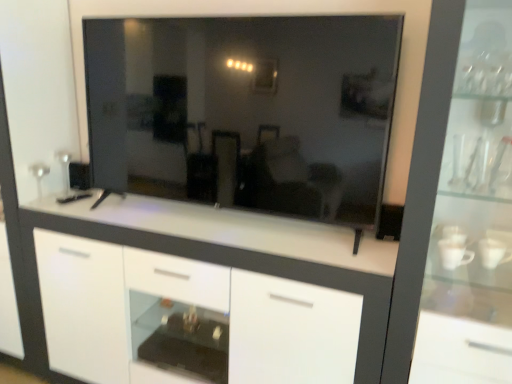
What are the coordinates of `transparent glass cabinet at right` in the screenshot? It's located at (472, 215).

Image resolution: width=512 pixels, height=384 pixels. What do you see at coordinates (472, 215) in the screenshot?
I see `transparent glass cabinet at right` at bounding box center [472, 215].

Measure the distance between transparent glass mirror at center and camera.

The depth of transparent glass mirror at center is 4.47 feet.

You are a GUI agent. You are given a task and a screenshot of the screen. Output one action in this format:
    pyautogui.click(x=<x>, y=<y>)
    Task: Click on the transparent glass cabinet at right
    The width and height of the screenshot is (512, 384).
    Given the screenshot: What is the action you would take?
    pyautogui.click(x=472, y=215)

Would you say white glossy cabinet at center is a long distance from transparent glass cabinet at right?

No, there isn't a large distance between white glossy cabinet at center and transparent glass cabinet at right.

Considering the relative sizes of white glossy cabinet at center and transparent glass cabinet at right in the image provided, is white glossy cabinet at center thinner than transparent glass cabinet at right?

Incorrect, the width of white glossy cabinet at center is not less than that of transparent glass cabinet at right.

Is white glossy cabinet at center bigger than transparent glass cabinet at right?

Indeed, white glossy cabinet at center has a larger size compared to transparent glass cabinet at right.

Is transparent glass cabinet at right wider than transparent glass mirror at center?

Indeed, transparent glass cabinet at right has a greater width compared to transparent glass mirror at center.

Based on their sizes in the image, would you say transparent glass cabinet at right is bigger or smaller than transparent glass mirror at center?

In the image, transparent glass cabinet at right appears to be larger than transparent glass mirror at center.

Considering the positions of points (428, 268) and (270, 34), is point (428, 268) farther from camera compared to point (270, 34)?

Yes, point (428, 268) is farther from viewer.

Is white glossy cabinet at center situated inside transparent glass mirror at center or outside?

white glossy cabinet at center is not enclosed by transparent glass mirror at center.

Is white glossy cabinet at center aimed at transparent glass mirror at center?

No, white glossy cabinet at center is not facing towards transparent glass mirror at center.

Is white glossy cabinet at center further to camera compared to transparent glass mirror at center?

Yes, white glossy cabinet at center is further from the camera.

Consider the image. Would you consider white glossy cabinet at center to be distant from transparent glass mirror at center?

They are positioned close to each other.

Considering the relative positions of transparent glass cabinet at right and white glossy cabinet at center in the image provided, is transparent glass cabinet at right to the left of white glossy cabinet at center from the viewer's perspective?

Incorrect, transparent glass cabinet at right is not on the left side of white glossy cabinet at center.

Which object is wider, transparent glass cabinet at right or white glossy cabinet at center?

Wider between the two is white glossy cabinet at center.

Between point (489, 115) and point (264, 296), which one is positioned behind?

The point (264, 296) is behind.

Would you say transparent glass mirror at center is outside transparent glass cabinet at right?

Yes, transparent glass mirror at center is not within transparent glass cabinet at right.

From a real-world perspective, who is located lower, transparent glass mirror at center or transparent glass cabinet at right?

transparent glass cabinet at right, from a real-world perspective.

Is transparent glass mirror at center smaller than transparent glass cabinet at right?

Indeed, transparent glass mirror at center has a smaller size compared to transparent glass cabinet at right.

At what (x,y) coordinates should I click in order to perform the action: click on mirror behind the transparent glass cabinet at right. Please return your answer as a coordinate pair (x, y). Looking at the image, I should click on (246, 110).

Is transparent glass mirror at center situated inside white glossy cabinet at center or outside?

transparent glass mirror at center cannot be found inside white glossy cabinet at center.

Considering the relative positions of transparent glass mirror at center and white glossy cabinet at center in the image provided, is transparent glass mirror at center to the right of white glossy cabinet at center from the viewer's perspective?

Yes.

Based on the photo, is transparent glass mirror at center taller than white glossy cabinet at center?

In fact, transparent glass mirror at center may be shorter than white glossy cabinet at center.

Is transparent glass mirror at center behind white glossy cabinet at center?

That is False.

Where is `cabinetry below the transparent glass cabinet at right (from the image's perspective)`? The width and height of the screenshot is (512, 384). cabinetry below the transparent glass cabinet at right (from the image's perspective) is located at coordinates (186, 310).

The image size is (512, 384). In order to click on dresser that appears below the transparent glass mirror at center (from a real-world perspective) in this screenshot , I will do `click(472, 215)`.

From the picture: Estimate the real-world distances between objects in this image. Which object is further from transparent glass cabinet at right, white glossy cabinet at center or transparent glass mirror at center?

white glossy cabinet at center lies further to transparent glass cabinet at right than the other object.

Which object lies nearer to the anchor point transparent glass mirror at center, white glossy cabinet at center or transparent glass cabinet at right?

white glossy cabinet at center is positioned closer to the anchor transparent glass mirror at center.

Which object lies nearer to the anchor point transparent glass mirror at center, transparent glass cabinet at right or white glossy cabinet at center?

Among the two, white glossy cabinet at center is located nearer to transparent glass mirror at center.

Looking at the image, which one is located closer to white glossy cabinet at center, transparent glass cabinet at right or transparent glass mirror at center?

Based on the image, transparent glass mirror at center appears to be nearer to white glossy cabinet at center.

Which object lies further to the anchor point white glossy cabinet at center, transparent glass mirror at center or transparent glass cabinet at right?

Among the two, transparent glass cabinet at right is located further to white glossy cabinet at center.

Based on their spatial positions, is transparent glass mirror at center or white glossy cabinet at center closer to transparent glass cabinet at right?

Based on the image, transparent glass mirror at center appears to be nearer to transparent glass cabinet at right.

Where is `mirror located between white glossy cabinet at center and transparent glass cabinet at right in the left-right direction`? Image resolution: width=512 pixels, height=384 pixels. mirror located between white glossy cabinet at center and transparent glass cabinet at right in the left-right direction is located at coordinates (246, 110).